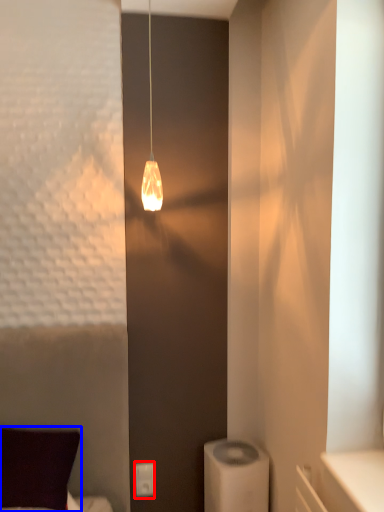
Question: Which object appears closest to the camera in this image, light switch (highlighted by a red box) or pillow (highlighted by a blue box)?

Choices:
 (A) light switch
 (B) pillow

Answer: (B)